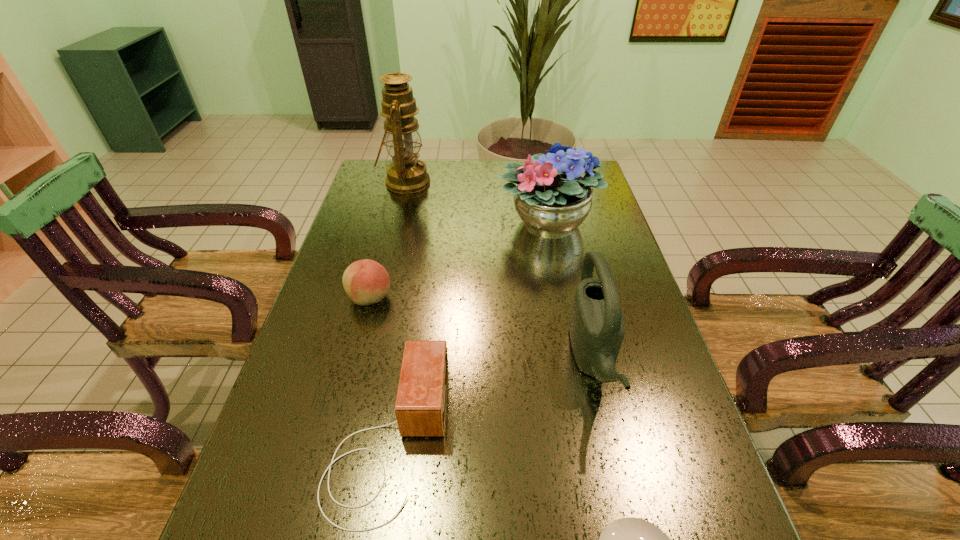
Find the location of a particular element. This screenshot has height=540, width=960. the tallest object is located at coordinates point(407,174).

Identify the location of bouquet. Image resolution: width=960 pixels, height=540 pixels. pos(551,197).

The image size is (960, 540). I want to click on watering can, so click(597, 328).

This screenshot has height=540, width=960. I want to click on peach, so click(x=366, y=282).

At what (x,y) coordinates should I click in order to perform the action: click on radio receiver. Please return your answer as a coordinate pair (x, y). The width and height of the screenshot is (960, 540). Looking at the image, I should click on (420, 409).

Identify the location of vacant position located 0.360m on the right of the tallest object. (529, 182).

Find the location of a particular element. free location located 0.210m on the back of the bouquet is located at coordinates (537, 168).

The image size is (960, 540). What are the coordinates of `free space located 0.050m on the spout of the watering can` in the screenshot? It's located at (551, 360).

This screenshot has height=540, width=960. Find the location of `vacant area situated on the spout of the watering can`. vacant area situated on the spout of the watering can is located at coordinates (482, 360).

The image size is (960, 540). I want to click on free point located 0.110m on the spout of the watering can, so click(525, 360).